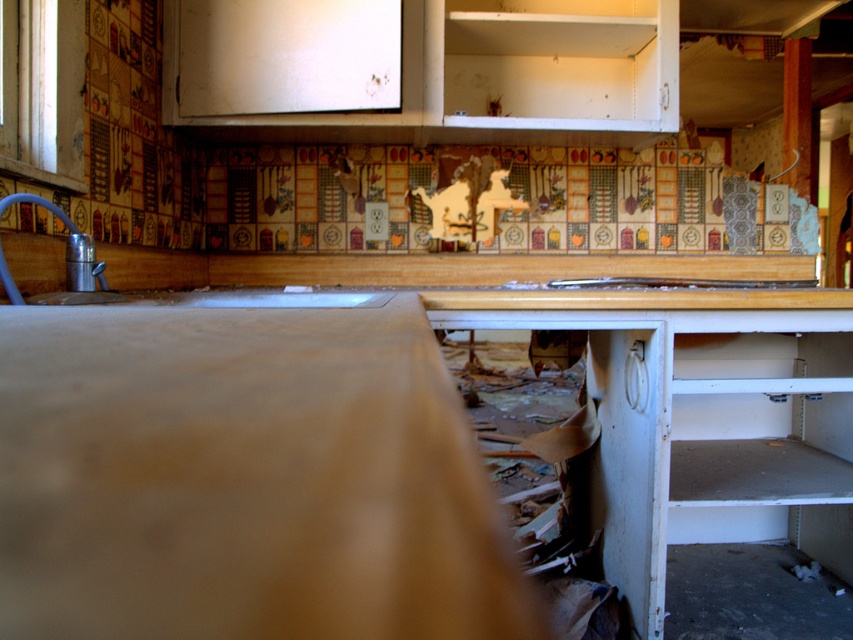
Question: Which object is positioned farthest from the matte wood counter top at center?

Choices:
 (A) silver metallic faucet at left
 (B) white matte cabinet at upper center

Answer: (B)

Question: Which object appears farthest from the camera in this image?

Choices:
 (A) white matte cabinet at upper center
 (B) silver metallic faucet at left
 (C) matte wood counter top at center

Answer: (A)

Question: Does white matte cabinet at upper center appear under silver metallic faucet at left?

Choices:
 (A) yes
 (B) no

Answer: (B)

Question: Can you confirm if white matte cabinet at upper center is bigger than silver metallic faucet at left?

Choices:
 (A) yes
 (B) no

Answer: (A)

Question: Which object appears closest to the camera in this image?

Choices:
 (A) silver metallic faucet at left
 (B) white matte cabinet at upper center
 (C) matte wood counter top at center

Answer: (C)

Question: Is white matte cabinet at upper center thinner than silver metallic faucet at left?

Choices:
 (A) no
 (B) yes

Answer: (A)